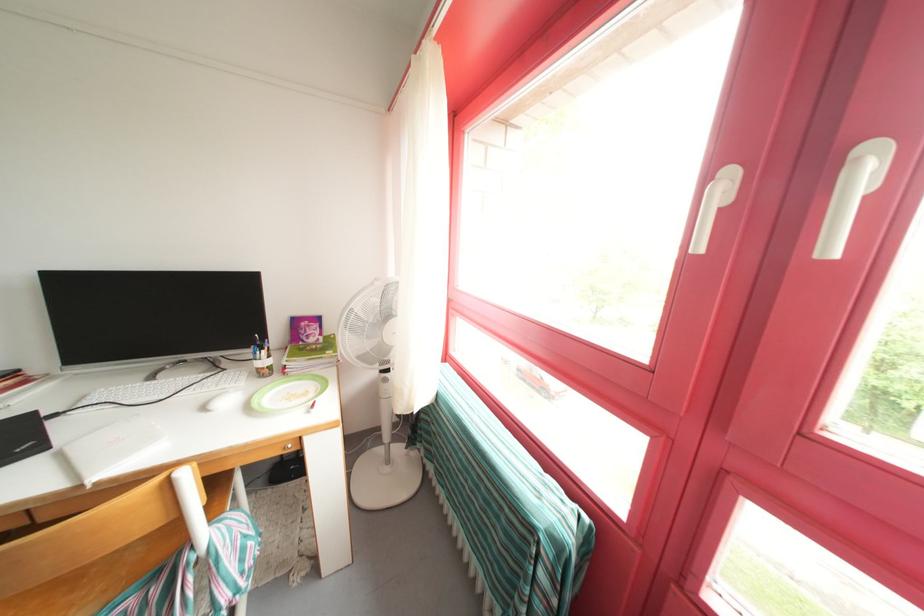
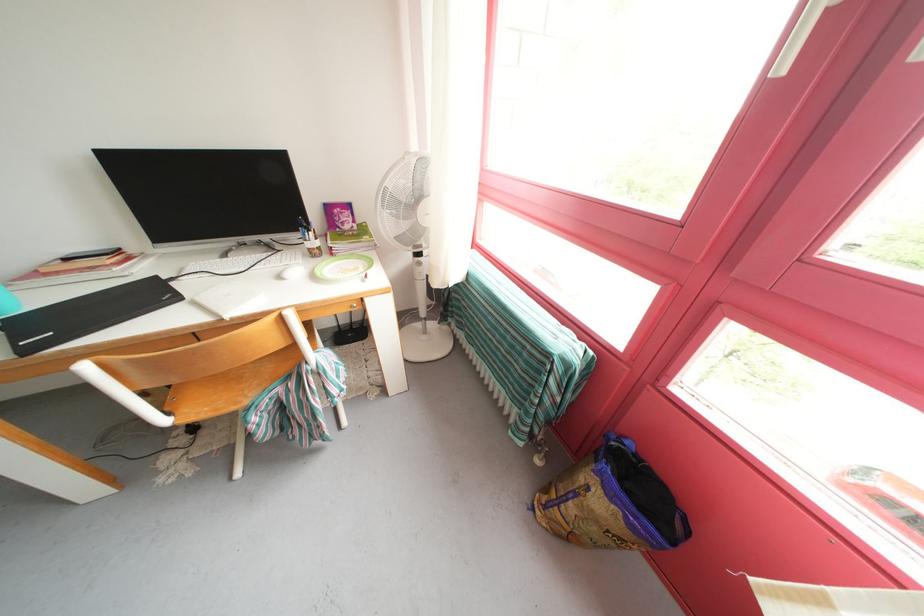
Where in the second image is the point corresponding to point (269, 355) from the first image?

(315, 236)